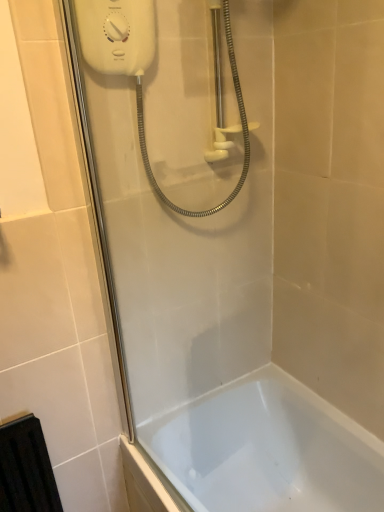
Question: Considering the relative positions of white plastic shower at upper center and white glossy shower door at upper left in the image provided, is white plastic shower at upper center to the right of white glossy shower door at upper left from the viewer's perspective?

Choices:
 (A) yes
 (B) no

Answer: (A)

Question: Is white glossy shower door at upper left surrounded by white plastic shower at upper center?

Choices:
 (A) no
 (B) yes

Answer: (A)

Question: Does white plastic shower at upper center lie behind white glossy shower door at upper left?

Choices:
 (A) no
 (B) yes

Answer: (B)

Question: Is white plastic shower at upper center positioned with its back to white glossy shower door at upper left?

Choices:
 (A) yes
 (B) no

Answer: (B)

Question: Is white plastic shower at upper center facing towards white glossy shower door at upper left?

Choices:
 (A) no
 (B) yes

Answer: (A)

Question: Does white plastic shower at upper center have a lesser width compared to white glossy shower door at upper left?

Choices:
 (A) yes
 (B) no

Answer: (B)

Question: Is white glossy bathtub at lower center not within white plastic shower at upper center?

Choices:
 (A) no
 (B) yes

Answer: (B)

Question: Is white glossy bathtub at lower center placed right next to white plastic shower at upper center?

Choices:
 (A) no
 (B) yes

Answer: (A)

Question: Can you confirm if white glossy bathtub at lower center is wider than white plastic shower at upper center?

Choices:
 (A) no
 (B) yes

Answer: (B)

Question: From the image's perspective, is white glossy bathtub at lower center above white plastic shower at upper center?

Choices:
 (A) yes
 (B) no

Answer: (B)

Question: Would you say white glossy bathtub at lower center is a long distance from white plastic shower at upper center?

Choices:
 (A) yes
 (B) no

Answer: (B)

Question: From a real-world perspective, is white glossy bathtub at lower center on top of white plastic shower at upper center?

Choices:
 (A) yes
 (B) no

Answer: (B)

Question: Is white plastic shower at upper center oriented away from white glossy bathtub at lower center?

Choices:
 (A) yes
 (B) no

Answer: (B)